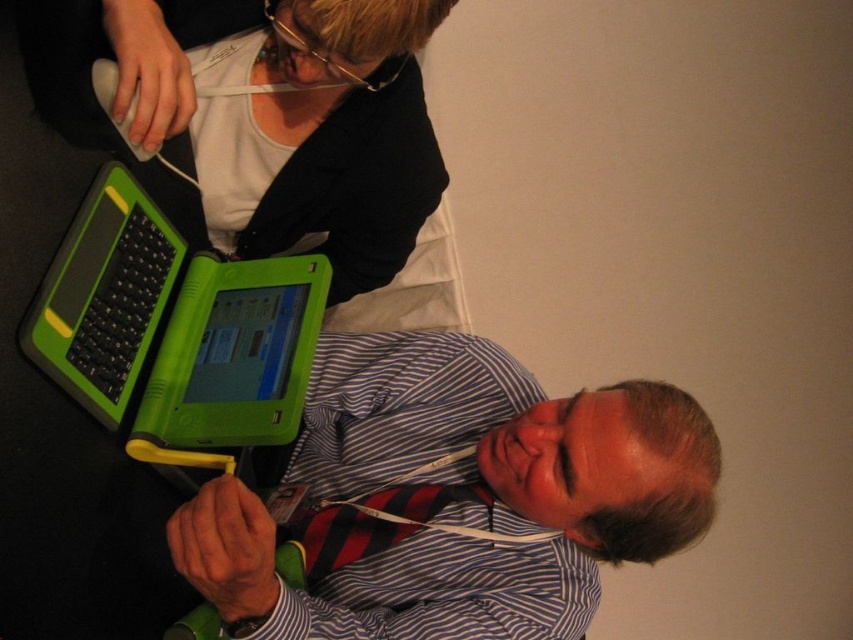
You are a photographer setting up a camera at eye level. You want to capture both the green plastic keyboard at lower left and the red striped tie at lower center in the same frame. Which object will appear larger in the photo?

The green plastic keyboard at lower left will appear larger in the photo because it has a greater height compared to the red striped tie at lower center.

You are standing in front of a conference desk with a 30 inch monitor. You need to place the green plastic laptop at lower left on the desk so that it is exactly 30 inches away from the camera. Is the current distance of the laptop sufficient?

The green plastic laptop at lower left is currently 27.86 inches away from the camera. Since 27.86 inches is less than 30 inches, the laptop is too close. You need to move it further away to meet the required distance.

You are a person with a 1.5 inch wide notebook. You want to place it between the green plastic laptop at lower left and the green plastic keyboard at lower left. Will it fit?

The green plastic laptop at lower left and green plastic keyboard at lower left are 1.50 inches apart. Since the notebook is 1.5 inches wide, it should fit between them without overlapping either device.